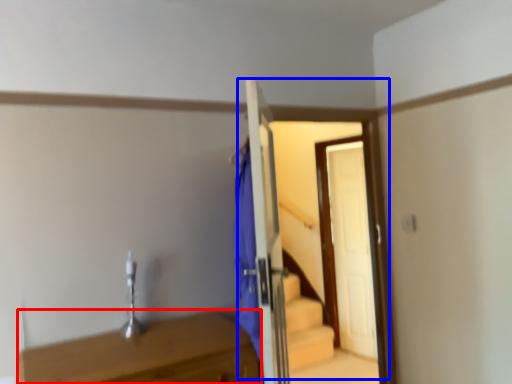
Question: Which object is further to the camera taking this photo, table (highlighted by a red box) or door (highlighted by a blue box)?

Choices:
 (A) table
 (B) door

Answer: (B)